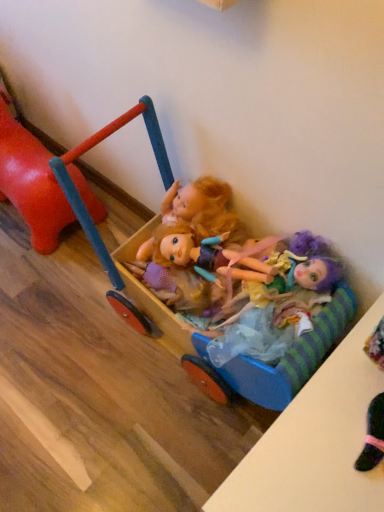
Question: From the image's perspective, is rubberized red horse at left, the 2th toy when ordered from right to left, over multicolored fabric doll at center?

Choices:
 (A) yes
 (B) no

Answer: (A)

Question: Is rubberized red horse at left, the 2th toy when ordered from right to left, positioned before multicolored fabric doll at center?

Choices:
 (A) yes
 (B) no

Answer: (B)

Question: Is multicolored fabric doll at center completely or partially inside rubberized red horse at left, the 2th toy when ordered from right to left?

Choices:
 (A) no
 (B) yes

Answer: (A)

Question: Are rubberized red horse at left, the first toy viewed from the left, and multicolored fabric doll at center beside each other?

Choices:
 (A) yes
 (B) no

Answer: (B)

Question: From the image's perspective, is rubberized red horse at left, the 2th toy when ordered from right to left, beneath multicolored fabric doll at center?

Choices:
 (A) yes
 (B) no

Answer: (B)

Question: Is multicolored fabric doll at center in front of or behind wooden cart at center, which is the second toy from left to right, in the image?

Choices:
 (A) front
 (B) behind

Answer: (B)

Question: From a real-world perspective, is multicolored fabric doll at center above or below wooden cart at center, which is the second toy from left to right?

Choices:
 (A) below
 (B) above

Answer: (B)

Question: In terms of height, does multicolored fabric doll at center look taller or shorter compared to wooden cart at center, which is the second toy from left to right?

Choices:
 (A) tall
 (B) short

Answer: (B)

Question: In terms of size, does multicolored fabric doll at center appear bigger or smaller than wooden cart at center, which is the first toy from right to left?

Choices:
 (A) small
 (B) big

Answer: (A)

Question: Looking at the image, does multicolored fabric doll at center seem bigger or smaller compared to rubberized red horse at left, the 2th toy when ordered from right to left?

Choices:
 (A) big
 (B) small

Answer: (B)

Question: From the image's perspective, is multicolored fabric doll at center positioned above or below rubberized red horse at left, the 2th toy when ordered from right to left?

Choices:
 (A) above
 (B) below

Answer: (B)

Question: Would you say multicolored fabric doll at center is to the left or to the right of rubberized red horse at left, the first toy viewed from the left, in the picture?

Choices:
 (A) right
 (B) left

Answer: (A)

Question: Relative to rubberized red horse at left, the first toy viewed from the left, is multicolored fabric doll at center in front or behind?

Choices:
 (A) behind
 (B) front

Answer: (B)

Question: Considering the relative positions of rubberized red horse at left, the first toy viewed from the left, and multicolored fabric doll at center in the image provided, is rubberized red horse at left, the first toy viewed from the left, to the left or to the right of multicolored fabric doll at center?

Choices:
 (A) left
 (B) right

Answer: (A)

Question: Do you think rubberized red horse at left, the first toy viewed from the left, is within multicolored fabric doll at center, or outside of it?

Choices:
 (A) inside
 (B) outside

Answer: (B)